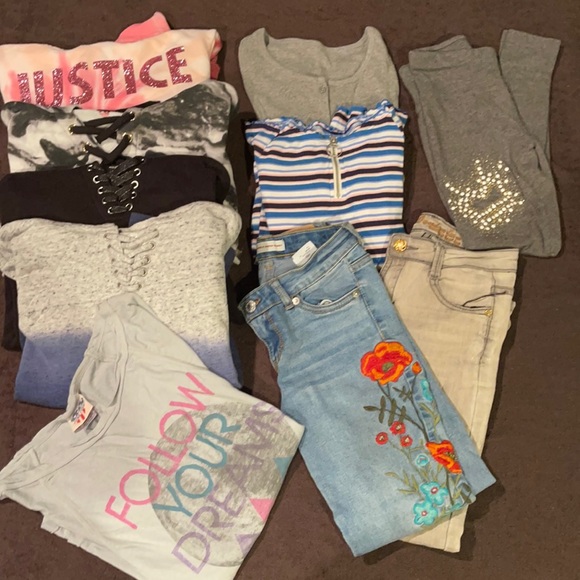
Find the location of a particular element. This screenshot has height=580, width=580. folded shirts is located at coordinates (193, 483), (176, 300), (311, 163), (306, 93), (172, 60), (157, 108), (145, 184).